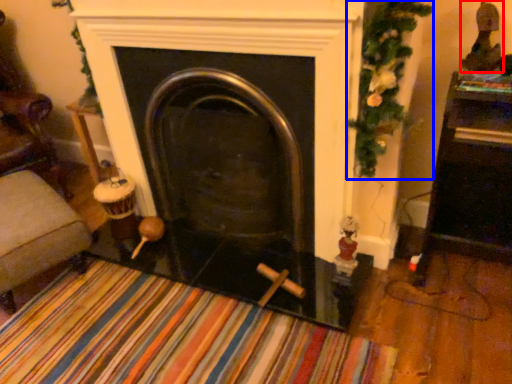
Question: Among these objects, which one is farthest to the camera, toy (highlighted by a red box) or christmas decoration (highlighted by a blue box)?

Choices:
 (A) toy
 (B) christmas decoration

Answer: (A)